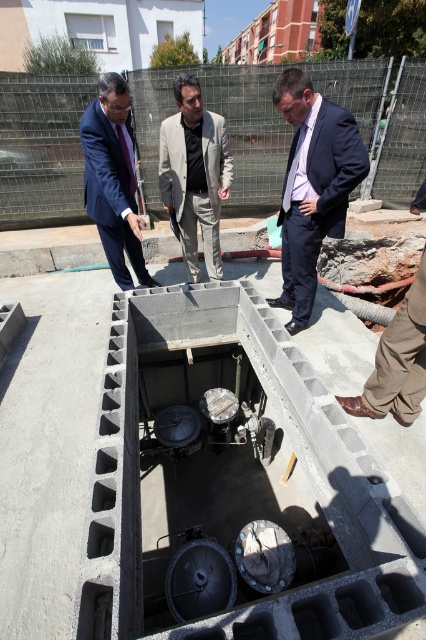
You are a construction worker standing at the edge of the gray concrete structure. You need to locate the man in the dark blue suit at center. Where should you look relative to your position?

The dark blue suit at center is located at the coordinates point (313, 186) relative to your position at the edge of the structure.

You are a construction inspector who needs to ensure all workers are wearing proper safety gear. You see the dark blue suit at center and the light gray suit at center. Which worker might need a safety helmet adjustment due to their height?

The dark blue suit at center is much taller than the light gray suit at center, so the safety helmet might need adjustment for the dark blue suit at center to ensure proper fit.